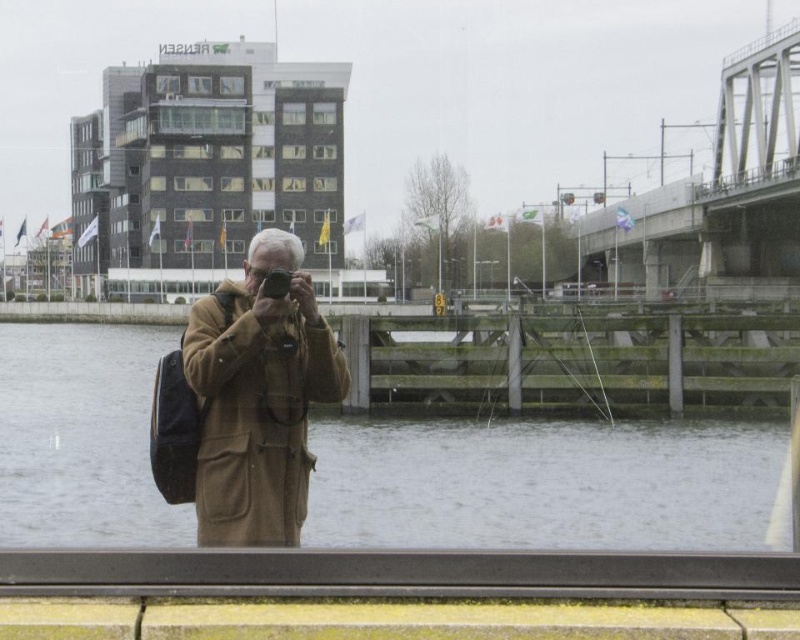
You are standing on a bridge and want to take a photo of the brown water at center with your matte black camera at center. Which object is closer to you when you look through the camera viewfinder?

The brown water at center is closer to you than the matte black camera at center when looking through the camera viewfinder because the brown water at center is further to the viewer than the matte black camera at center.